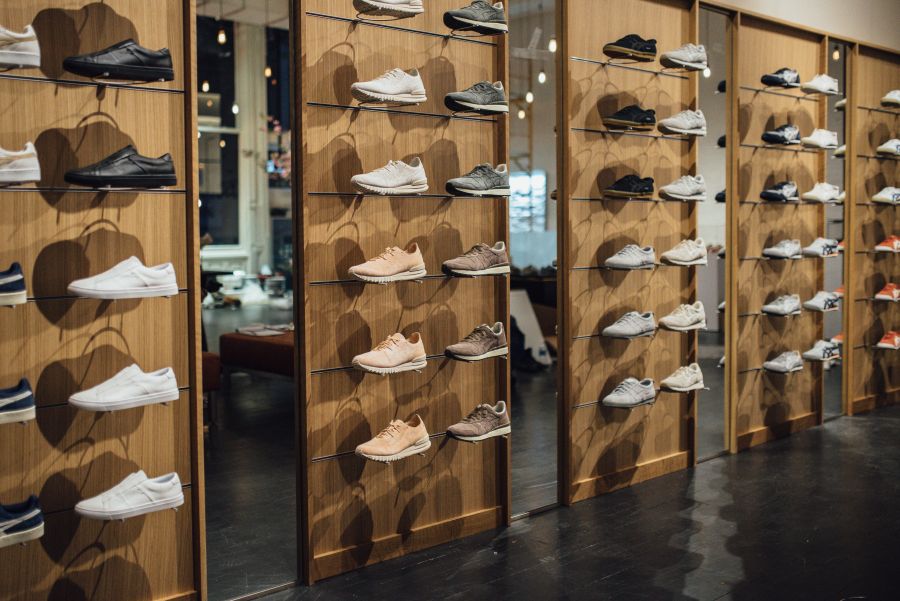
You are a GUI agent. You are given a task and a screenshot of the screen. Output one action in this format:
    pyautogui.click(x=<x>, y=<y>)
    Task: Click on the mirrors
    
    Given the screenshot: What is the action you would take?
    pyautogui.click(x=265, y=194), pyautogui.click(x=527, y=194), pyautogui.click(x=711, y=192), pyautogui.click(x=838, y=177)